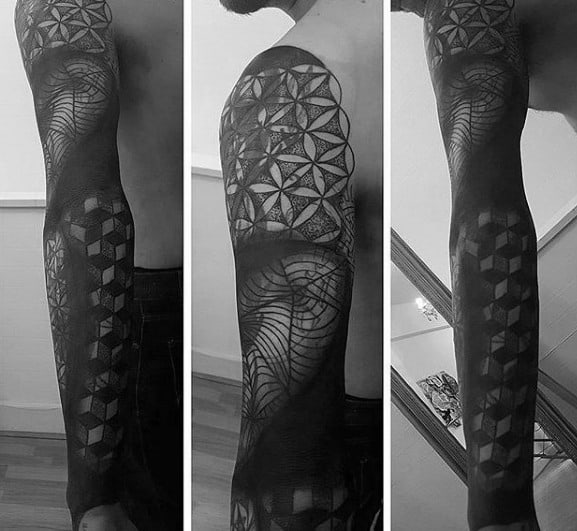
The image size is (577, 531). What are the coordinates of `mirror` in the screenshot? It's located at click(421, 355).